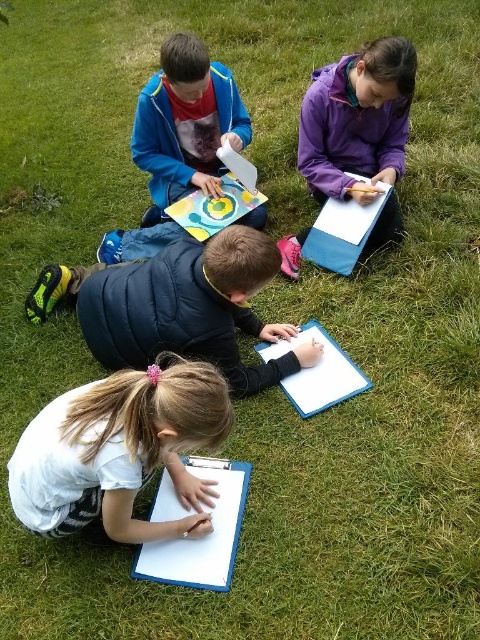
You are a photographer standing at the center of the scene. You want to take a photo of the white paper at lower left. Where should you point your camera to capture it?

You should point your camera towards the lower left area at coordinate point (120, 451) to capture the white paper at lower left.

You are a teacher observing the children. You notice the white paper at lower left and the matte blue jacket at upper center. Which object is located to the left of the other?

The white paper at lower left is positioned on the left side of matte blue jacket at upper center.

Based on the photo, you are a photographer standing at the edge of the grassy area where the children are drawing. You want to take a photo that includes both the white paper at lower left and the purple fleece jacket at upper right without moving any of the children. Is there enough space between them for your camera lens to capture both in the same frame?

The white paper at lower left and the purple fleece jacket at upper right are 4.63 feet apart. Since the distance between them is 4.63 feet, your camera lens should be able to capture both in the same frame as long as your camera has a wide enough angle or you position yourself appropriately to include both elements within the frame.